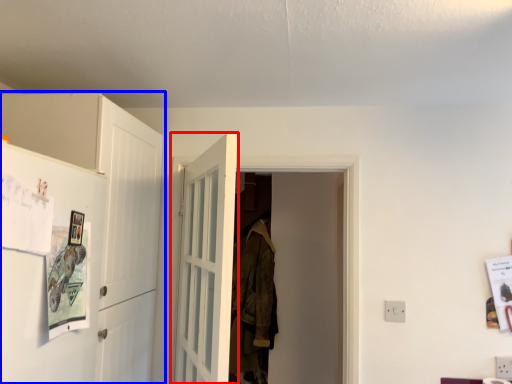
Question: Which object appears closest to the camera in this image, door (highlighted by a red box) or cabinetry (highlighted by a blue box)?

Choices:
 (A) door
 (B) cabinetry

Answer: (A)